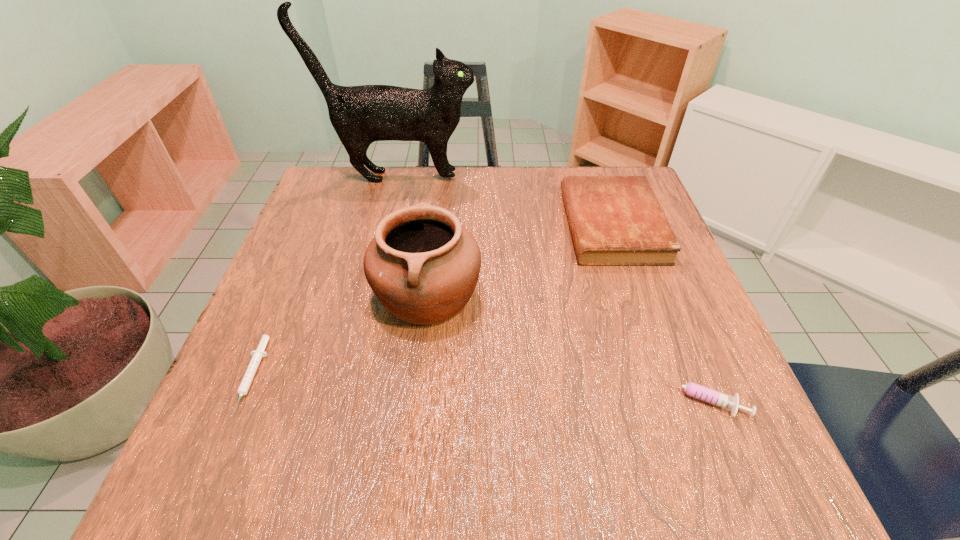
At what (x,y) coordinates should I click in order to perform the action: click on object that is the second closest one to the right syringe. Please return your answer as a coordinate pair (x, y). Looking at the image, I should click on (423, 266).

The height and width of the screenshot is (540, 960). What are the coordinates of `vacant space that satisfies the following two spatial constraints: 1. on the back side of the right syringe; 2. on the face of the cat` in the screenshot? It's located at (612, 177).

I want to click on free space that satisfies the following two spatial constraints: 1. on the spine side of the third tallest object; 2. on the front side of the second tallest object, so click(x=635, y=294).

Find the location of a particular element. vacant area in the image that satisfies the following two spatial constraints: 1. on the face of the tallest object; 2. on the left side of the fourth tallest object is located at coordinates (347, 399).

The height and width of the screenshot is (540, 960). In order to click on free spot that satisfies the following two spatial constraints: 1. on the face of the tallest object; 2. on the back side of the pottery in this screenshot , I will do `click(372, 294)`.

This screenshot has height=540, width=960. I want to click on vacant space that satisfies the following two spatial constraints: 1. on the front side of the taller syringe; 2. on the left side of the second tallest object, so click(415, 399).